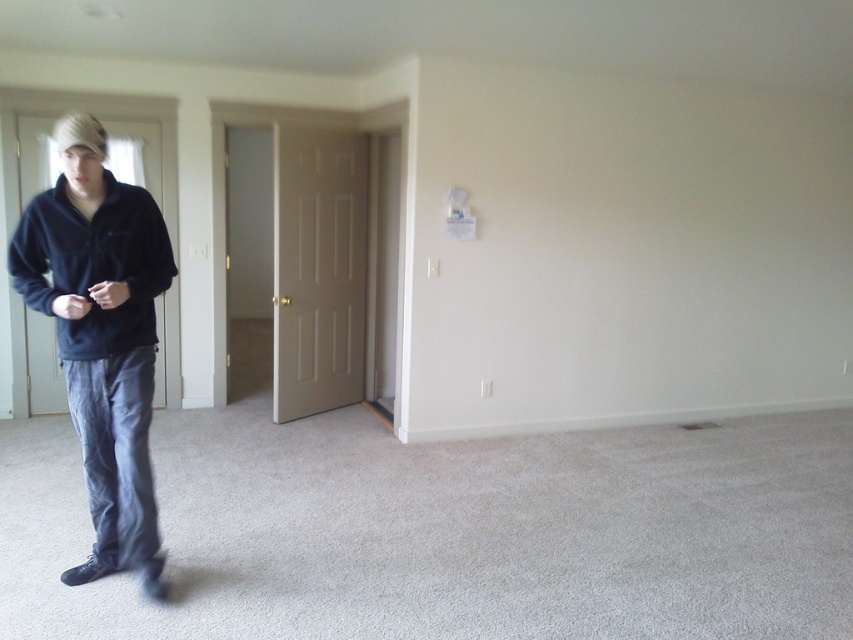
You are standing in the living room and see the dark blue fleece jacket at left. Where exactly is it located in terms of coordinates?

The dark blue fleece jacket at left is located at coordinates 0.525 on the x axis and 0.120 on the y axis.